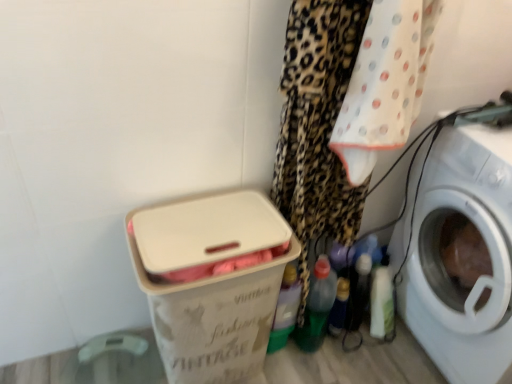
Question: Is translucent plastic bottle at lower center in front of or behind white plastic washing machine at right in the image?

Choices:
 (A) front
 (B) behind

Answer: (B)

Question: Looking at their shapes, would you say translucent plastic bottle at lower center is wider or thinner than white plastic washing machine at right?

Choices:
 (A) wide
 (B) thin

Answer: (B)

Question: Which of these objects is positioned farthest from the white plastic laundry basket at lower left?

Choices:
 (A) white plastic washing machine at right
 (B) translucent plastic bottle at lower center

Answer: (A)

Question: Considering the real-world distances, which object is farthest from the white plastic laundry basket at lower left?

Choices:
 (A) translucent plastic bottle at lower center
 (B) white plastic washing machine at right

Answer: (B)